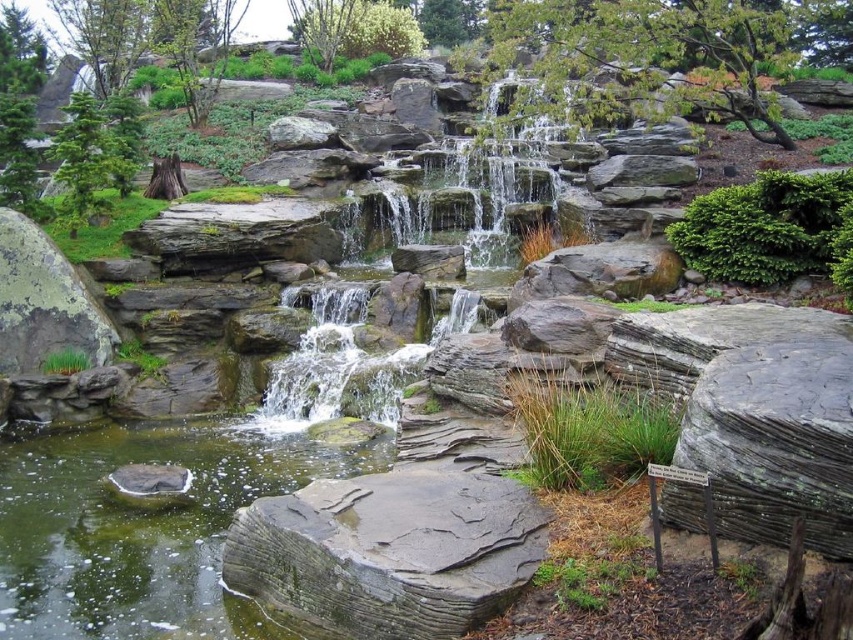
Is point (94, 604) less distant than point (436, 324)?

Yes, point (94, 604) is in front of point (436, 324).

Is point (134, 593) farther from camera compared to point (457, 301)?

No, it is in front of (457, 301).

Locate an element on the screen. greenish stone water at lower left is located at coordinates (142, 529).

Is greenish stone water at lower left taller than gray slate boulder at lower center?

No.

Locate an element on the screen. The height and width of the screenshot is (640, 853). greenish stone water at lower left is located at coordinates (142, 529).

Between green mossy rock at center and green mossy rock at left, which one is positioned higher?

green mossy rock at center is higher up.

Is green mossy rock at center to the left of green mossy rock at left from the viewer's perspective?

Incorrect, green mossy rock at center is not on the left side of green mossy rock at left.

Does point (518, 180) come behind point (21, 280)?

Yes, it is behind point (21, 280).

Image resolution: width=853 pixels, height=640 pixels. I want to click on green mossy rock at center, so click(x=349, y=362).